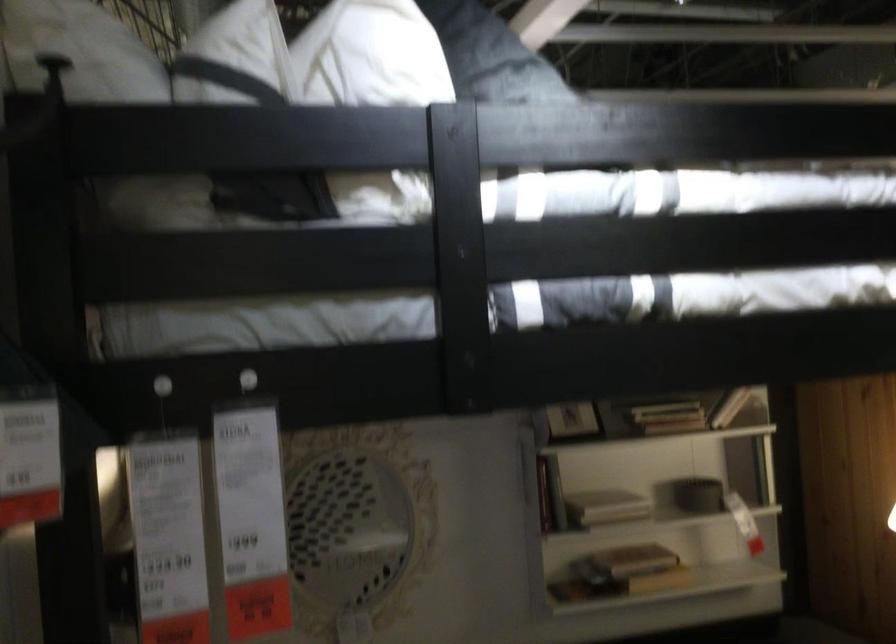
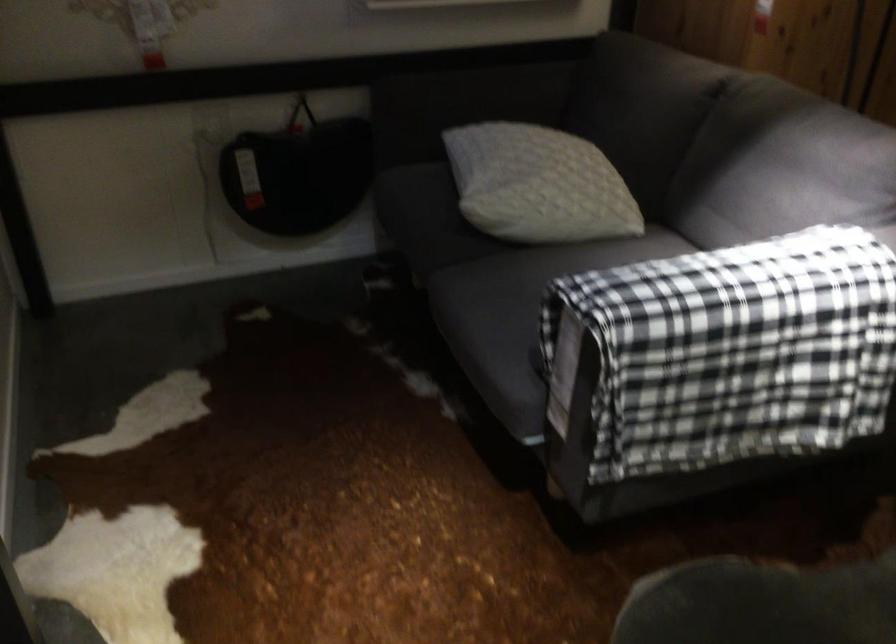
Question: The images are taken continuously from a first-person perspective. In which direction is your viewpoint rotating?

Choices:
 (A) Left
 (B) Right
 (C) Up
 (D) Down

Answer: (D)